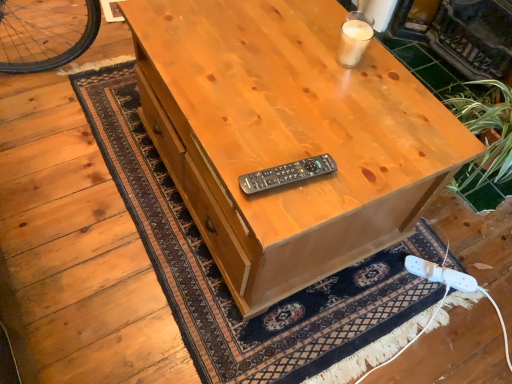
The height and width of the screenshot is (384, 512). What are the coordinates of `vacant point to the right of black plastic remote at center` in the screenshot? It's located at (350, 174).